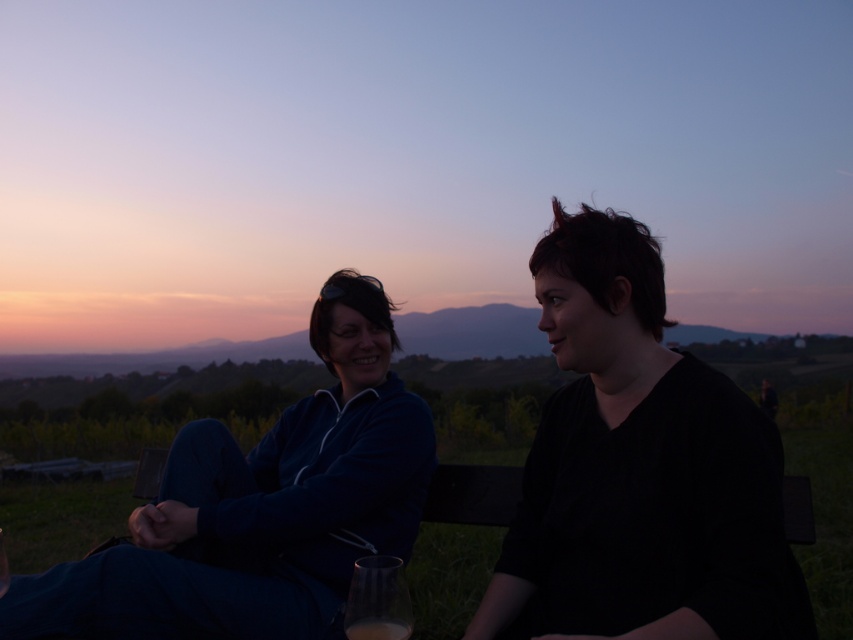
You are designing a group photo and need to ensure that the black matte shirt at center and the matte blue jacket at left are visible. Considering their sizes, which one might require more attention in terms of lighting to ensure visibility?

The black matte shirt at center has a smaller size compared to the matte blue jacket at left, so it might require more attention in terms of lighting to ensure visibility.

You are trying to find the dark blue jacket at center and the matte blue jacket at left in the image. Which one is positioned more to the right?

The matte blue jacket at left is positioned more to the right than the dark blue jacket at center.